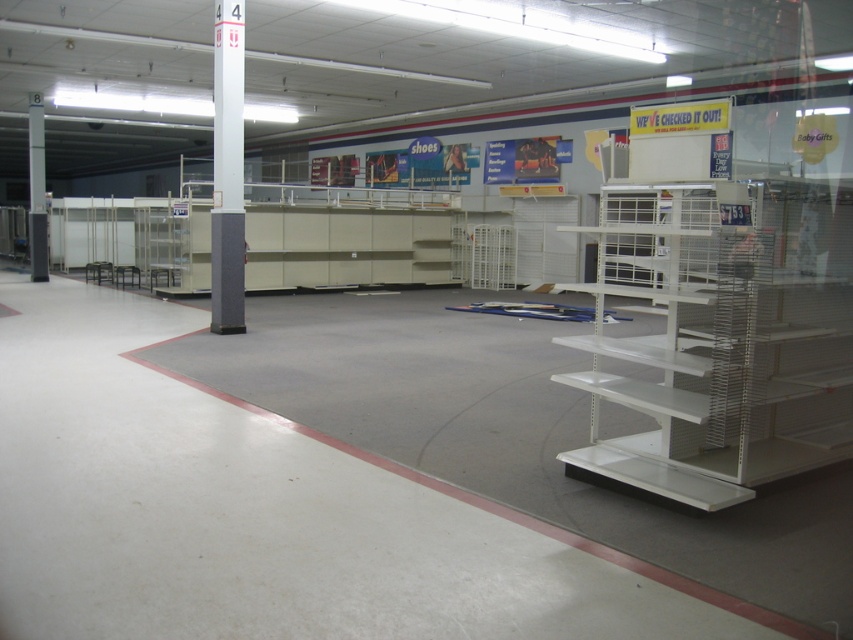
You are a store employee who needs to move the white metal shelf at right and the white textured pole at center to the storage room. The storage room has a height limit of 1.8 meters. Can both items fit vertically without being disassembled?

The white metal shelf at right has a smaller size compared to white textured pole at center. Since the pole is taller, it might exceed the 1.8 meters height limit. However, without exact measurements, it is uncertain if both can fit. Consult the dimensions before moving.

You are a store employee who needs to place a new banner. You have two options for placement locations near the white textured pole at center and the gray concrete pillar at left. Which location is higher up?

The gray concrete pillar at left is higher up because the white textured pole at center is located below it.

You are a store manager assessing the layout of your retail space. You need to place a new rectangular display stand that is 1.2 meters wide. You have two options for placement between the white textured pole at center and the gray concrete pillar at left. Which pole or pillar would allow the display stand to fit snugly without blocking the walkway? Please consider their widths as described.

The white textured pole at center has a lesser width compared to the gray concrete pillar at left. Since the display stand is 1.2 meters wide, placing it next to the white textured pole at center would leave more space for the walkway, as it is narrower than the gray concrete pillar at left.